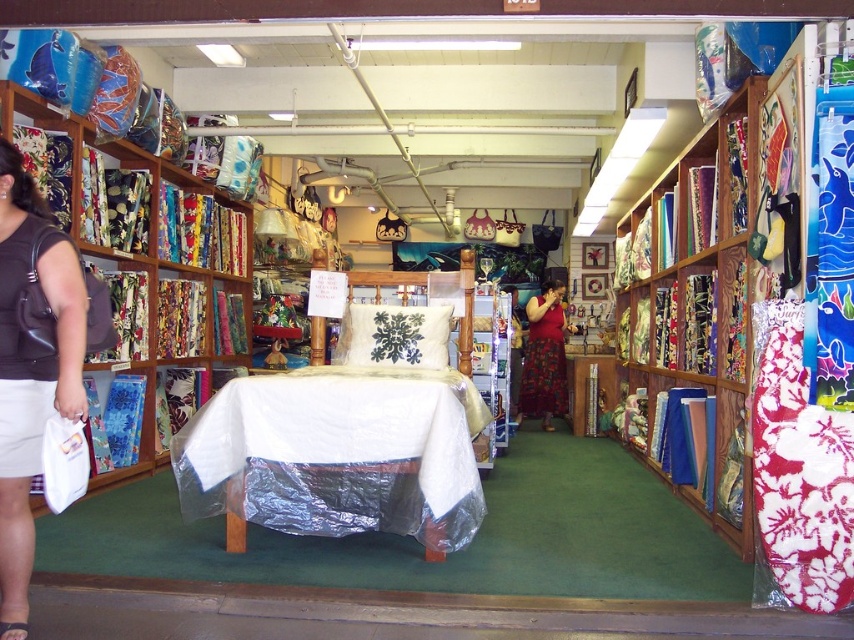
You are a customer in the fabric store and want to pick up the brown leather sandal at lower left. However, there is a matte fabric bookshelf at left blocking your path. Can you reach the sandal without moving the bookshelf?

The brown leather sandal at lower left is behind the matte fabric bookshelf at left, so you can reach it without moving the bookshelf by going around the side or back of the shelf.